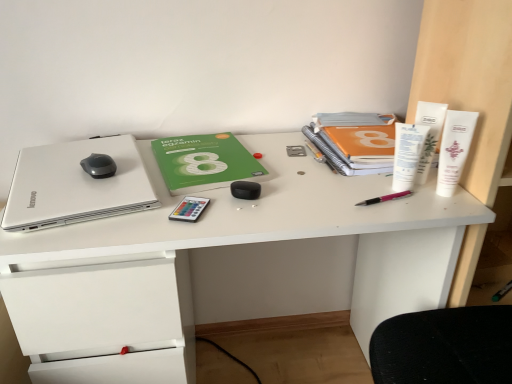
Locate an element on the screen. free area in between black plastic remote control at center-left, the 1th stationery in the left-to-right sequence, and white plastic tube at upper right, which is the fifth stationery in left-to-right order is located at coordinates (308, 203).